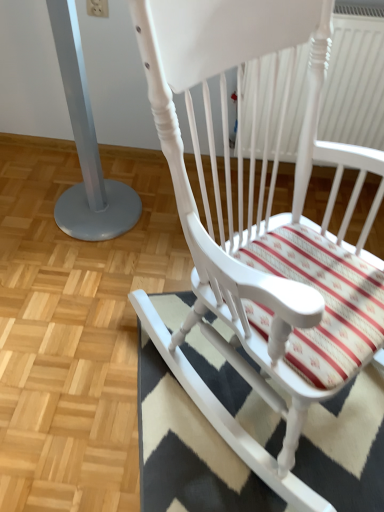
Question: From a real-world perspective, is silver metallic pole at left beneath white painted wood rocking chair at center?

Choices:
 (A) yes
 (B) no

Answer: (A)

Question: Are silver metallic pole at left and white painted wood rocking chair at center beside each other?

Choices:
 (A) yes
 (B) no

Answer: (B)

Question: Is silver metallic pole at left closer to the viewer compared to white painted wood rocking chair at center?

Choices:
 (A) yes
 (B) no

Answer: (B)

Question: From the image's perspective, is silver metallic pole at left above white painted wood rocking chair at center?

Choices:
 (A) yes
 (B) no

Answer: (A)

Question: Is silver metallic pole at left aimed at white painted wood rocking chair at center?

Choices:
 (A) yes
 (B) no

Answer: (B)

Question: Considering the relative positions of silver metallic pole at left and white painted wood rocking chair at center in the image provided, is silver metallic pole at left to the right of white painted wood rocking chair at center from the viewer's perspective?

Choices:
 (A) yes
 (B) no

Answer: (B)

Question: From the image's perspective, does white painted wood rocking chair at center appear lower than silver metallic pole at left?

Choices:
 (A) no
 (B) yes

Answer: (B)

Question: Is white painted wood rocking chair at center not close to silver metallic pole at left?

Choices:
 (A) no
 (B) yes

Answer: (A)

Question: Is white painted wood rocking chair at center looking in the opposite direction of silver metallic pole at left?

Choices:
 (A) yes
 (B) no

Answer: (A)

Question: From the image's perspective, is white painted wood rocking chair at center over silver metallic pole at left?

Choices:
 (A) no
 (B) yes

Answer: (A)

Question: Does white painted wood rocking chair at center come in front of silver metallic pole at left?

Choices:
 (A) yes
 (B) no

Answer: (A)

Question: Can you confirm if white painted wood rocking chair at center is positioned to the left of silver metallic pole at left?

Choices:
 (A) yes
 (B) no

Answer: (B)

Question: Is black-and-white striped rug at lower right oriented towards white painted wood rocking chair at center?

Choices:
 (A) yes
 (B) no

Answer: (B)